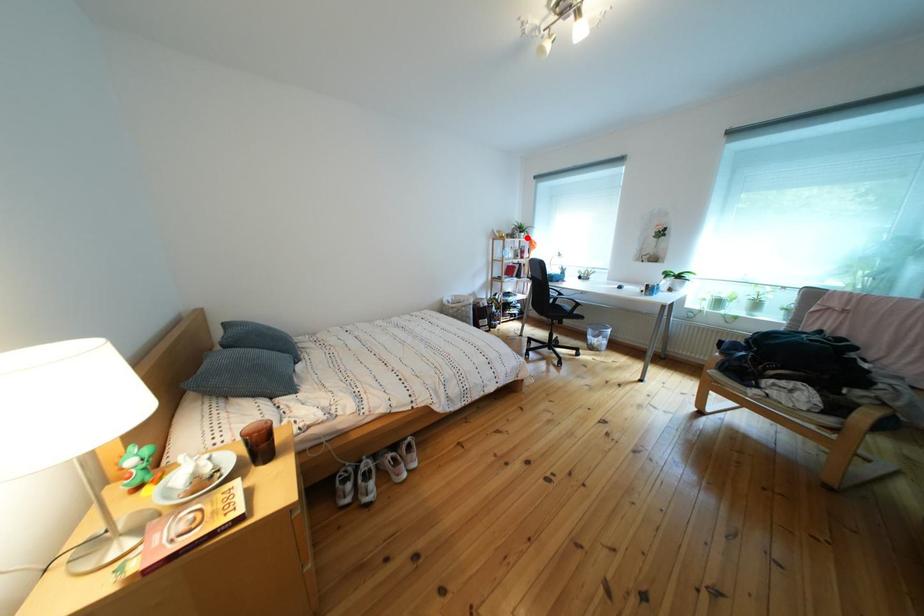
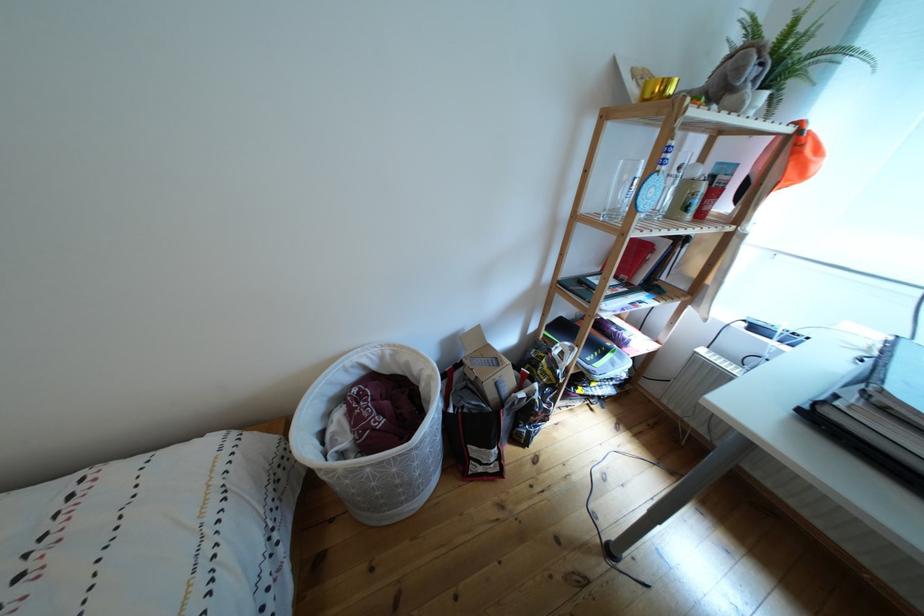
Where in the second image is the point corresponding to the highlighted location from the first image?

(762, 77)